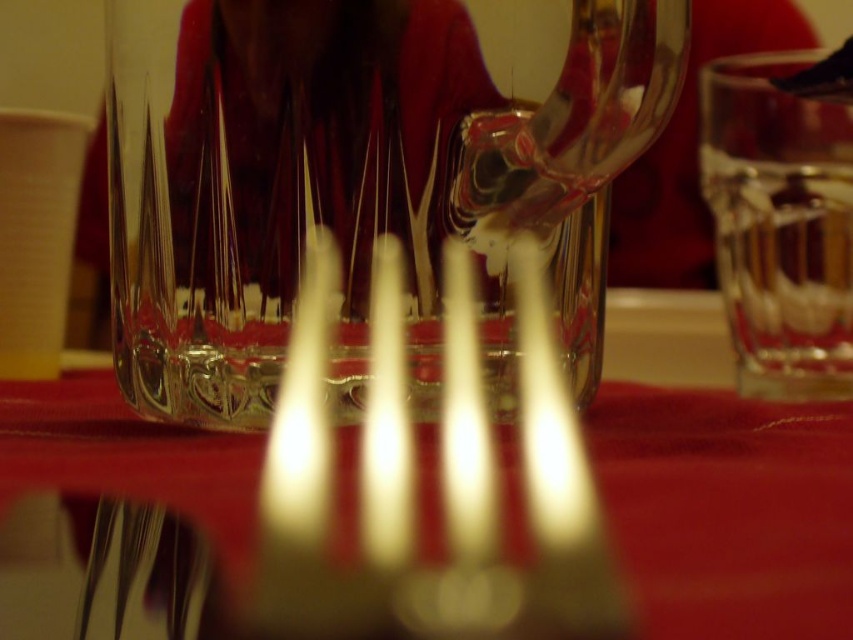
Question: Is clear glass wine glass at center further to the viewer compared to red velvet tablecloth at center?

Choices:
 (A) yes
 (B) no

Answer: (A)

Question: Which object is closer to the camera taking this photo?

Choices:
 (A) red velvet tablecloth at center
 (B) clear glass wine glass at center

Answer: (A)

Question: Which object is closer to the camera taking this photo?

Choices:
 (A) red velvet tablecloth at center
 (B) clear glass wine glass at center

Answer: (A)

Question: Which of the following is the closest to the observer?

Choices:
 (A) (418, 300)
 (B) (630, 540)

Answer: (B)

Question: Does clear glass wine glass at center appear over red velvet tablecloth at center?

Choices:
 (A) yes
 (B) no

Answer: (A)

Question: Is clear glass wine glass at center below red velvet tablecloth at center?

Choices:
 (A) no
 (B) yes

Answer: (A)